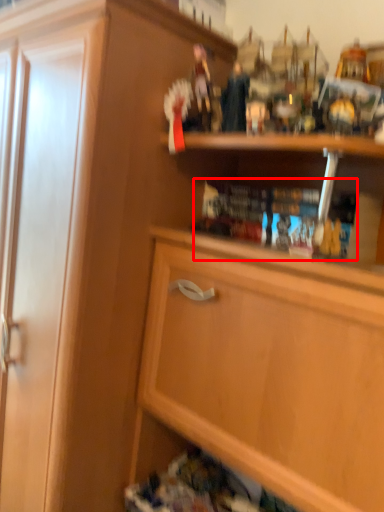
Question: Observing the image, what is the correct spatial positioning of book (annotated by the red box) in reference to cabinetry?

Choices:
 (A) right
 (B) left

Answer: (A)